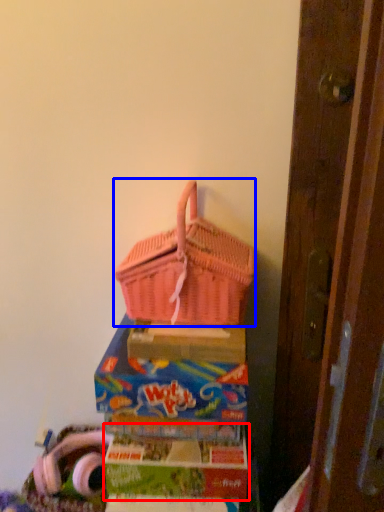
Question: Which point is closer to the camera, box (highlighted by a red box) or picnic basket (highlighted by a blue box)?

Choices:
 (A) box
 (B) picnic basket

Answer: (B)